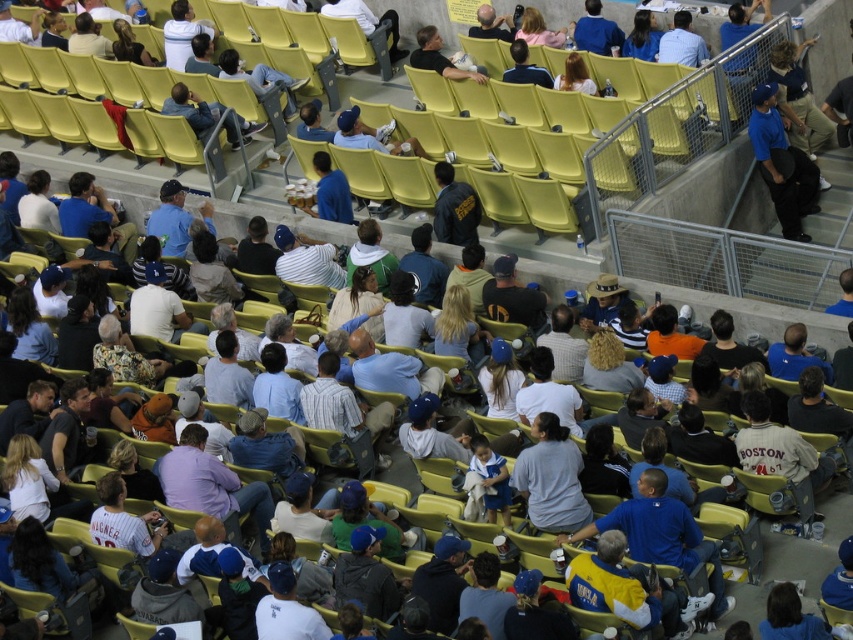
Question: Which point is farther to the camera?

Choices:
 (A) light gray shirt at center
 (B) denim jacket at center

Answer: (B)

Question: Estimate the real-world distances between objects in this image. Which object is closer to the denim jacket at center?

Choices:
 (A) blue matte baseball cap at upper right
 (B) blue denim jeans at center
 (C) blonde hair at center

Answer: (C)

Question: Is denim jacket at center thinner than blonde hair at center?

Choices:
 (A) yes
 (B) no

Answer: (A)

Question: Among these objects, which one is farthest from the camera?

Choices:
 (A) matte black shirt at center
 (B) blue denim jeans at center

Answer: (B)

Question: Is blue matte baseball cap at upper right smaller than denim jacket at center?

Choices:
 (A) yes
 (B) no

Answer: (B)

Question: In this image, where is denim jacket at center located relative to blonde hair at center?

Choices:
 (A) right
 (B) left

Answer: (B)